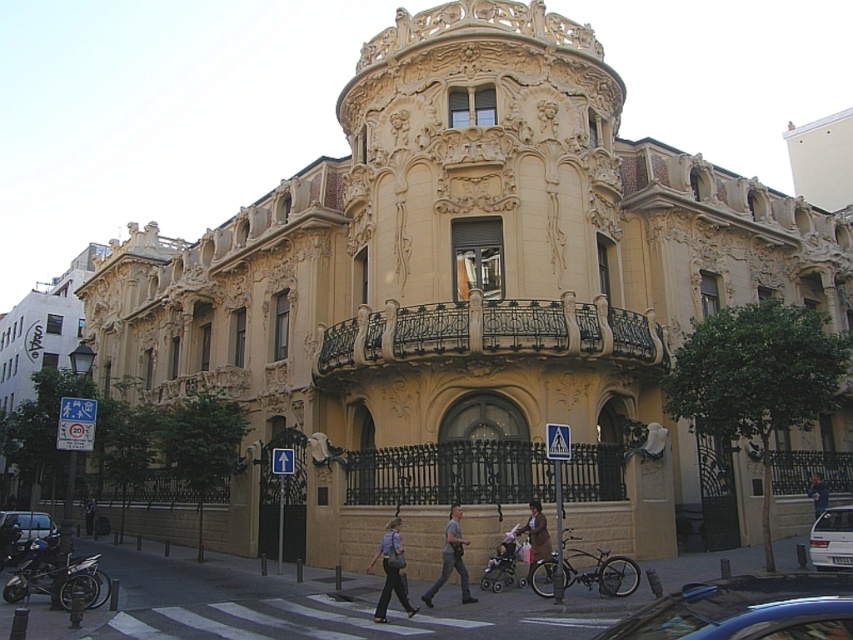
Question: Which object is closer to the camera taking this photo?

Choices:
 (A) blue fabric shirt at center
 (B) brown leather jacket at center
 (C) metallic silver car at lower left

Answer: (B)

Question: Is shiny blue car at lower right wider than dark gray fabric jacket at center?

Choices:
 (A) no
 (B) yes

Answer: (B)

Question: Which of the following is the farthest from the observer?

Choices:
 (A) gray fabric pants at center
 (B) dark gray fabric jacket at center
 (C) blue fabric shirt at center
 (D) brown leather jacket at center

Answer: (B)

Question: Among these points, which one is farthest from the camera?

Choices:
 (A) (84, 509)
 (B) (529, 532)
 (C) (425, 596)
 (D) (815, 531)

Answer: (A)

Question: Does brown leather jacket at center appear over dark gray fabric jacket at center?

Choices:
 (A) no
 (B) yes

Answer: (B)

Question: In this image, where is white matte car at center-right located relative to gray fabric pants at center?

Choices:
 (A) below
 (B) above

Answer: (B)